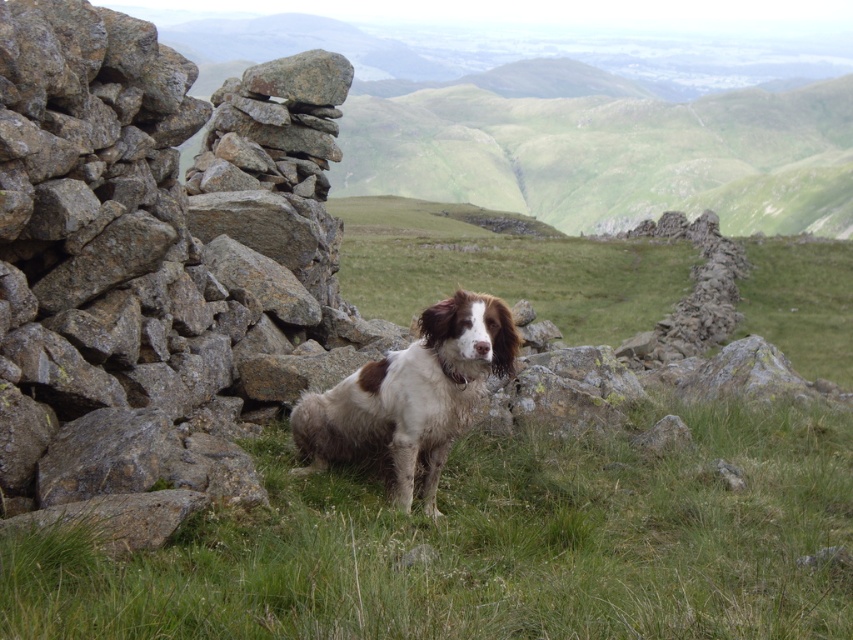
Between point (113, 44) and point (386, 371), which one is positioned behind?

Point (113, 44)

Who is positioned more to the right, rough gray rock at left or brown and white fur dog at center?

Positioned to the right is brown and white fur dog at center.

Who is more distant from viewer, (108, 275) or (437, 433)?

Positioned behind is point (108, 275).

This screenshot has height=640, width=853. I want to click on rough gray rock at left, so click(148, 268).